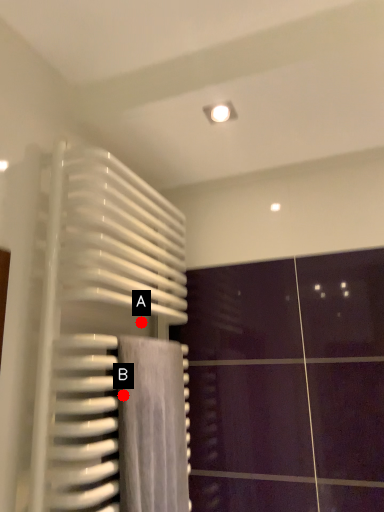
Question: Two points are circled on the image, labeled by A and B beside each circle. Which point is closer to the camera taking this photo?

Choices:
 (A) A is closer
 (B) B is closer

Answer: (B)